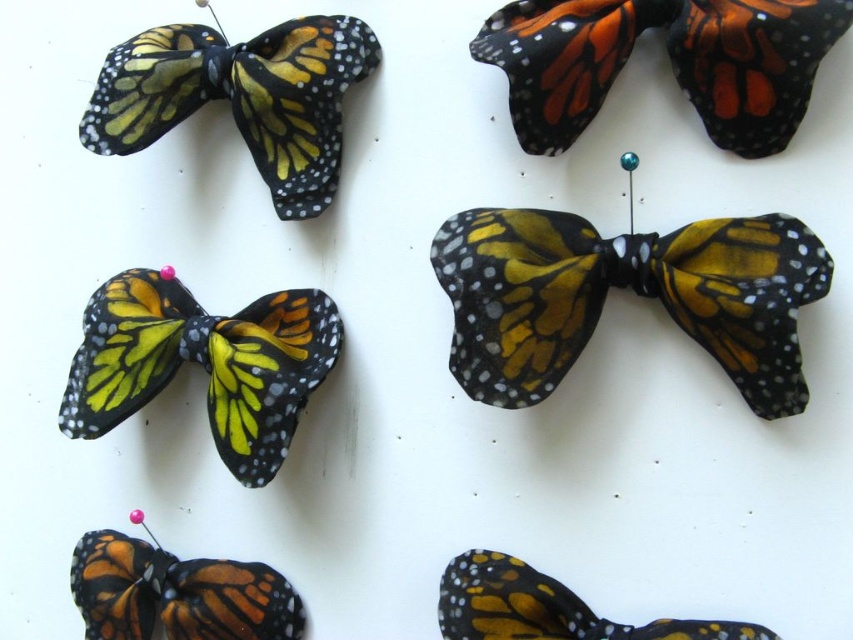
You are an interior designer arranging decorative items on a white wall. You have a matte fabric butterfly at upper left and a matte black bow at bottom right. Based on their positions, which object is more to the left?

The matte fabric butterfly at upper left is more to the left than the matte black bow at bottom right.